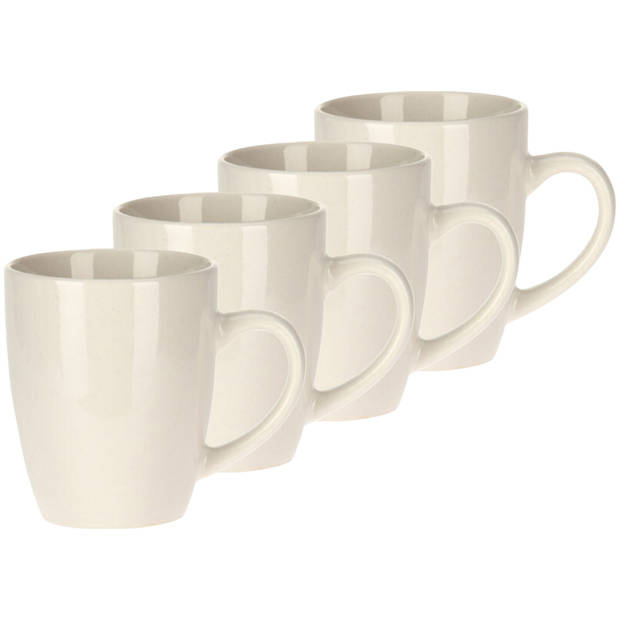
Find the location of a particular element. coffee cups is located at coordinates (117, 366), (249, 275), (487, 144), (377, 210).